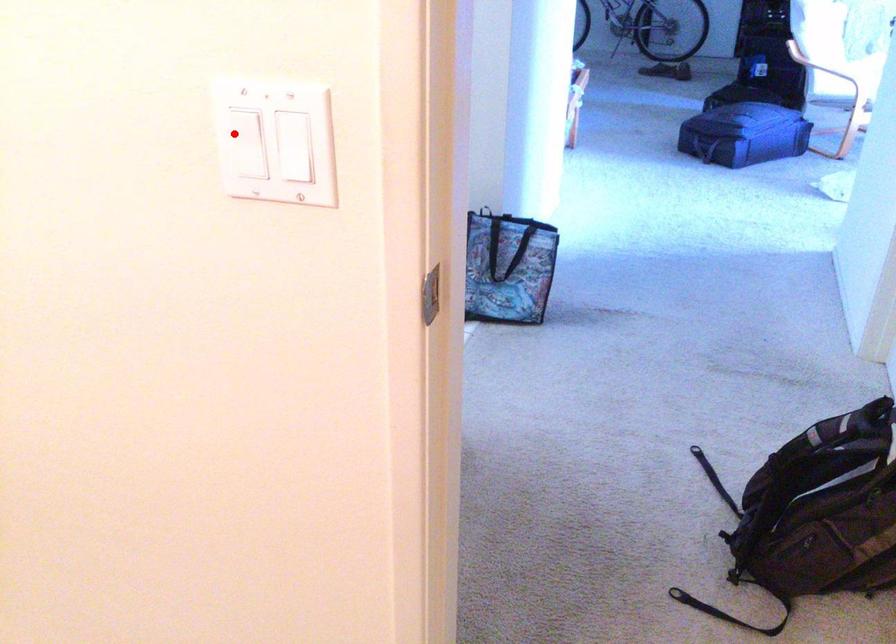
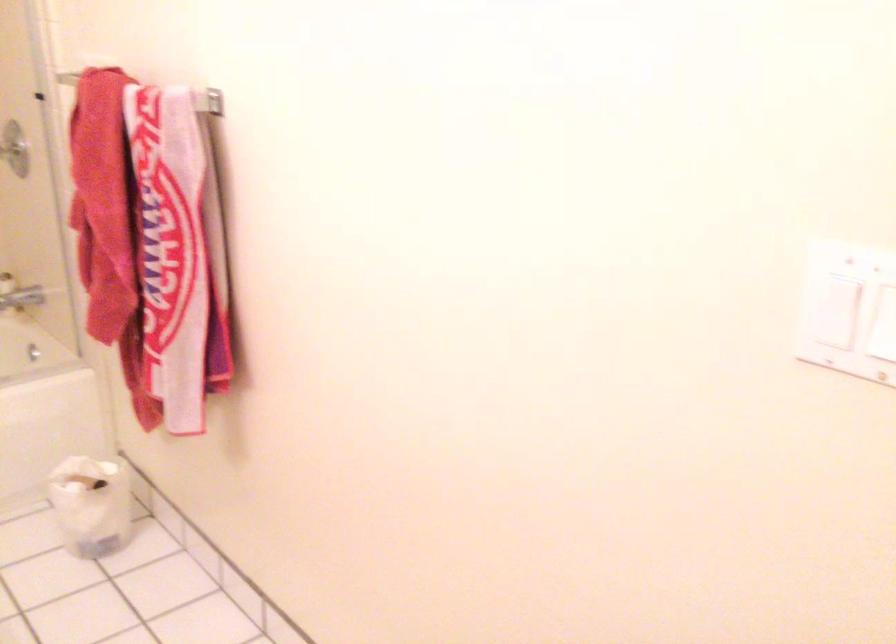
Where in the second image is the point corresponding to the highlighted location from the first image?

(831, 295)